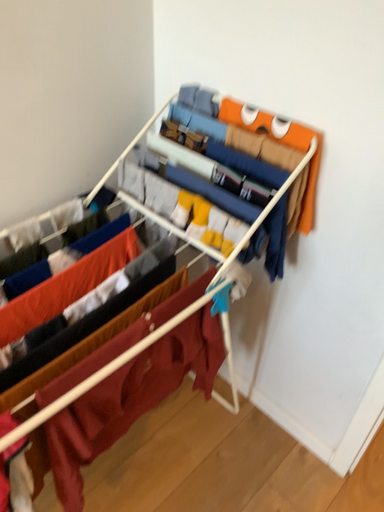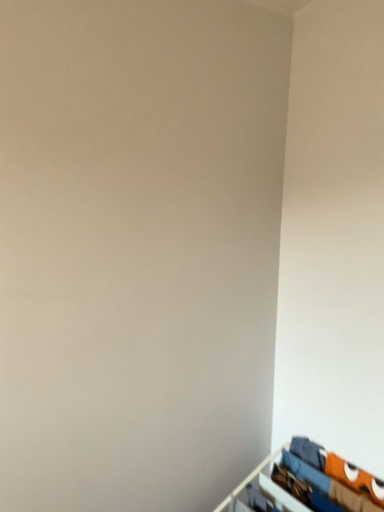
Question: Which way did the camera rotate in the video?

Choices:
 (A) rotated downward
 (B) rotated upward

Answer: (B)